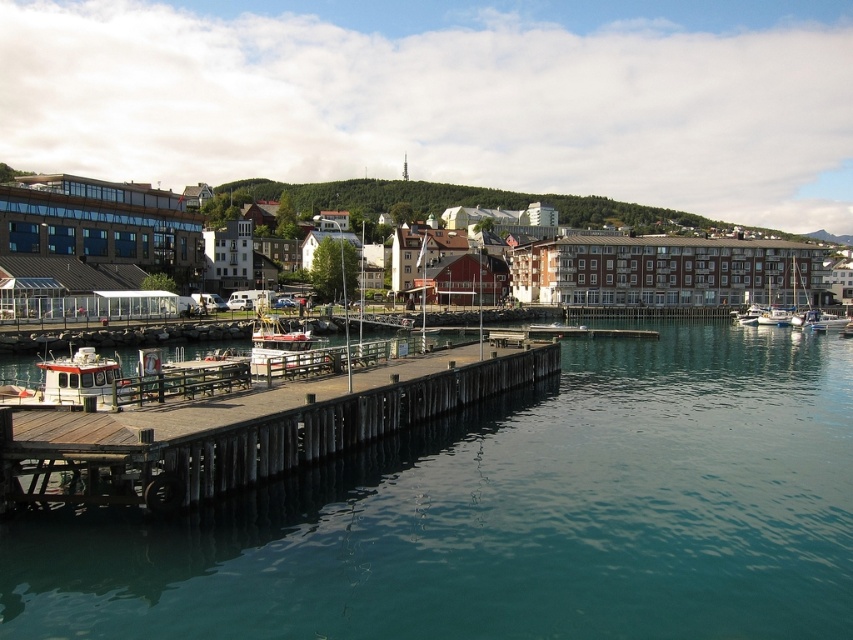
You are standing at the end of the wooden pier in the waterfront scene. You notice a point marked at coordinates (280, 348). What object is located at that point?

The point at (280, 348) corresponds to the white wooden boat at center.

You are standing on the wooden dock at center and looking towards the clear blue water at center. Which one appears taller from your viewpoint?

The clear blue water at center appears taller than the wooden dock at center from your viewpoint.